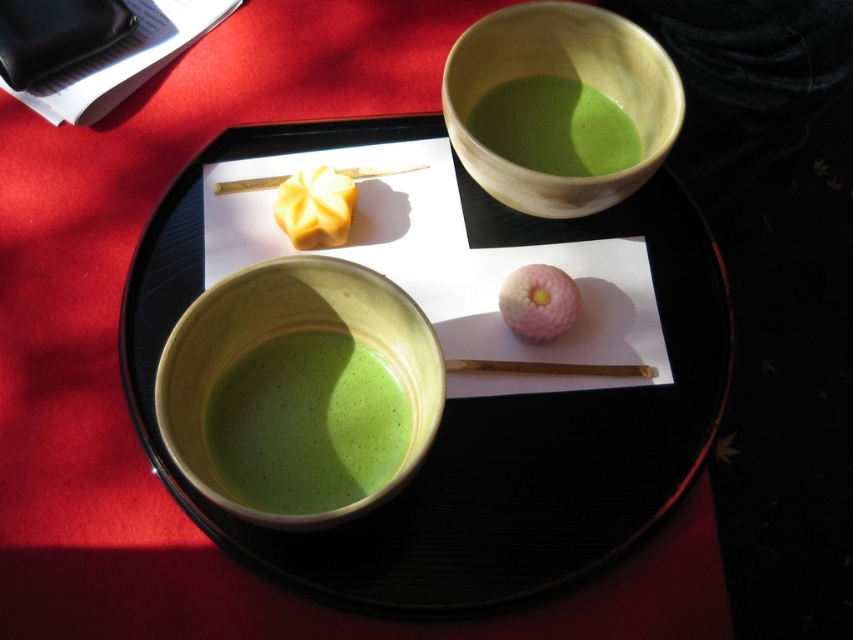
Question: Which point is closer to the camera?

Choices:
 (A) (358, 173)
 (B) (259, 522)
 (C) (631, 172)

Answer: (B)

Question: Which point is farther to the camera?

Choices:
 (A) wooden chopstick at upper center
 (B) green matte bowl at upper center
 (C) matte ceramic bowl at upper center

Answer: (A)

Question: Can you confirm if matte ceramic tray at center is wider than yellow creamy pastry at upper left?

Choices:
 (A) no
 (B) yes

Answer: (B)

Question: Can you confirm if matte ceramic tray at center is positioned below speckled ceramic bowl at center?

Choices:
 (A) yes
 (B) no

Answer: (B)

Question: From the image, what is the correct spatial relationship of matte ceramic tray at center in relation to matte ceramic bowl at upper center?

Choices:
 (A) right
 (B) left

Answer: (B)

Question: Which of the following is the closest to the observer?

Choices:
 (A) (569, 86)
 (B) (378, 484)
 (C) (531, 278)

Answer: (B)